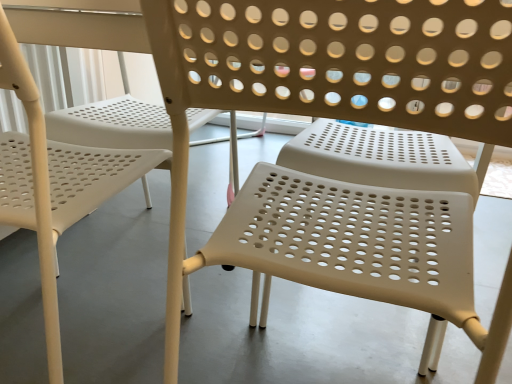
Question: Is beige plastic chair at center, the first chair viewed from the right, completely or partially inside white plastic chair at center, the second chair viewed from the right?

Choices:
 (A) yes
 (B) no

Answer: (B)

Question: Does white plastic chair at center, the second chair viewed from the right, lie behind beige plastic chair at center, the first chair viewed from the right?

Choices:
 (A) no
 (B) yes

Answer: (B)

Question: Is white plastic chair at center, placed as the 1th chair when sorted from left to right, in front of beige plastic chair at center, the first chair viewed from the right?

Choices:
 (A) yes
 (B) no

Answer: (B)

Question: Does white plastic chair at center, placed as the 1th chair when sorted from left to right, have a smaller size compared to beige plastic chair at center, the first chair viewed from the right?

Choices:
 (A) yes
 (B) no

Answer: (B)

Question: Could you tell me if white plastic chair at center, placed as the 1th chair when sorted from left to right, is facing beige plastic chair at center, the first chair viewed from the right?

Choices:
 (A) no
 (B) yes

Answer: (A)

Question: Is white plastic chair at center, placed as the 1th chair when sorted from left to right, thinner than beige plastic chair at center, the first chair viewed from the right?

Choices:
 (A) no
 (B) yes

Answer: (A)

Question: Can you confirm if beige plastic chair at center, the first chair viewed from the right, is shorter than white plastic chair at center, the second chair viewed from the right?

Choices:
 (A) no
 (B) yes

Answer: (A)

Question: From a real-world perspective, is beige plastic chair at center, the first chair viewed from the right, on top of white plastic chair at center, placed as the 1th chair when sorted from left to right?

Choices:
 (A) yes
 (B) no

Answer: (A)

Question: From a real-world perspective, is beige plastic chair at center, the first chair viewed from the right, physically below white plastic chair at center, the second chair viewed from the right?

Choices:
 (A) no
 (B) yes

Answer: (A)

Question: Is beige plastic chair at center, the 2th chair positioned from the left, wider than white plastic chair at center, the second chair viewed from the right?

Choices:
 (A) yes
 (B) no

Answer: (B)

Question: Considering the relative sizes of beige plastic chair at center, the first chair viewed from the right, and white plastic chair at center, placed as the 1th chair when sorted from left to right, in the image provided, is beige plastic chair at center, the first chair viewed from the right, thinner than white plastic chair at center, placed as the 1th chair when sorted from left to right,?

Choices:
 (A) yes
 (B) no

Answer: (A)

Question: From the image's perspective, is beige plastic chair at center, the 2th chair positioned from the left, located beneath white plastic chair at center, the second chair viewed from the right?

Choices:
 (A) yes
 (B) no

Answer: (A)

Question: Would you say white plastic chair at center, the second chair viewed from the right, is to the left or to the right of beige plastic chair at center, the first chair viewed from the right, in the picture?

Choices:
 (A) left
 (B) right

Answer: (A)